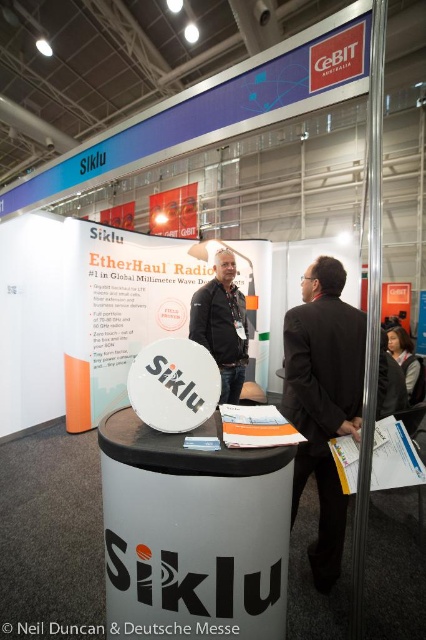
From the picture: You are a photographer at the trade show and want to capture a photo of the dark gray jacket at center and the orange paper portfolio at center. To ensure both are in focus, you need to know which object is taller. Which one is taller?

The dark gray jacket at center is taller than the orange paper portfolio at center.

You are attending CeBIT Australia and want to locate the Siklu booth. From the entrance, you see a circular display stand with the Siklu logo on a cylindrical pedestal at the front of the booth. Where would you find the dark gray jacket at center in relation to this display stand?

The dark gray jacket at center is located at point coordinates approximately 0.508 on the x and 0.521 on the y axis relative to the circular display stand with the Siklu logo on a cylindrical pedestal at the front of the booth.